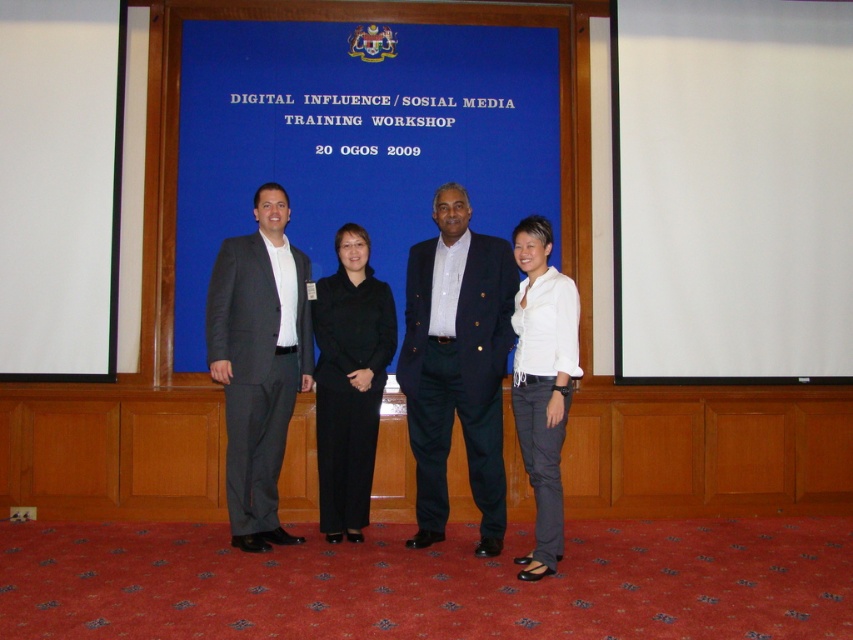
Can you confirm if white matte projection screen at right is positioned above white matte shirt at center?

Yes, white matte projection screen at right is above white matte shirt at center.

Between white matte projection screen at right and white matte shirt at center, which one has less height?

Standing shorter between the two is white matte shirt at center.

Identify the location of white matte projection screen at right. The image size is (853, 640). (732, 189).

From the picture: Which is below, white matte projection screen at right or dark blue blazer at center?

Positioned lower is dark blue blazer at center.

The height and width of the screenshot is (640, 853). In order to click on white matte projection screen at right in this screenshot , I will do `click(732, 189)`.

Can you confirm if matte gray suit at left is positioned to the right of white matte shirt at center?

Incorrect, matte gray suit at left is not on the right side of white matte shirt at center.

Who is taller, matte gray suit at left or white matte shirt at center?

Standing taller between the two is matte gray suit at left.

Describe the element at coordinates (258, 362) in the screenshot. This screenshot has width=853, height=640. I see `matte gray suit at left` at that location.

Where is `matte gray suit at left`? matte gray suit at left is located at coordinates (258, 362).